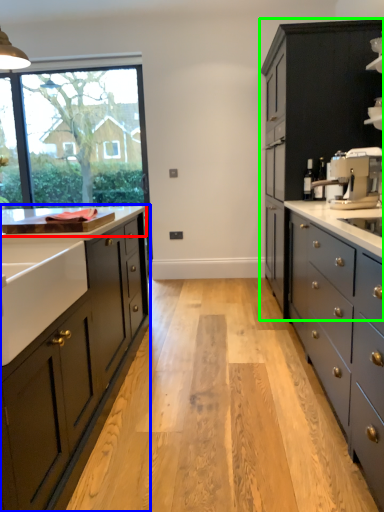
Question: Which object is positioned farthest from countertop (highlighted by a red box)? Select from cabinetry (highlighted by a blue box) and cabinetry (highlighted by a green box).

Choices:
 (A) cabinetry
 (B) cabinetry

Answer: (B)